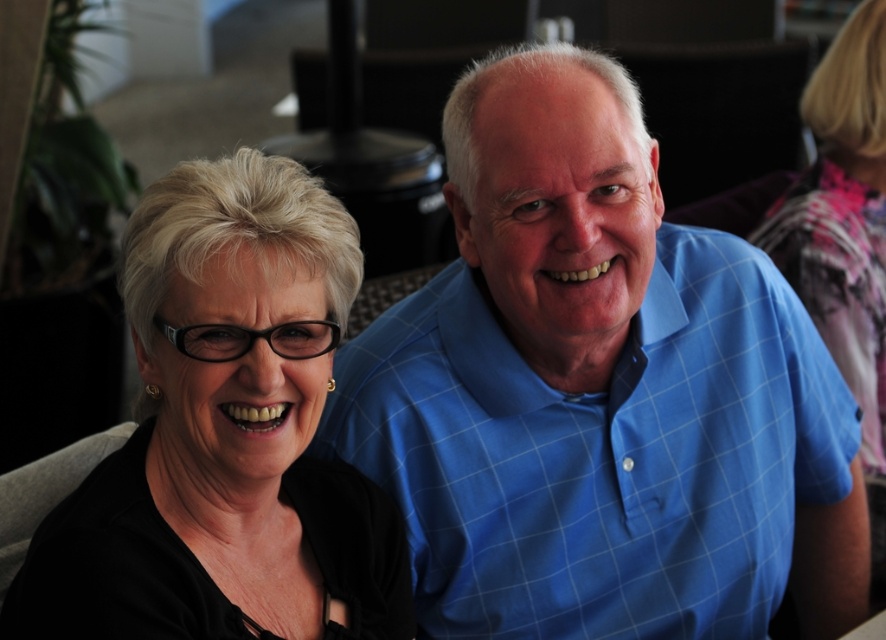
Question: Which point is closer to the camera taking this photo?

Choices:
 (A) (234, 397)
 (B) (728, 266)

Answer: (A)

Question: Does blue checkered shirt at center lie behind black matte glasses at left?

Choices:
 (A) no
 (B) yes

Answer: (B)

Question: Is blue checkered shirt at center to the right of black matte glasses at left from the viewer's perspective?

Choices:
 (A) yes
 (B) no

Answer: (A)

Question: Is blue checkered shirt at center positioned in front of black matte glasses at left?

Choices:
 (A) yes
 (B) no

Answer: (B)

Question: Which point appears farthest from the camera in this image?

Choices:
 (A) (785, 396)
 (B) (102, 609)

Answer: (A)